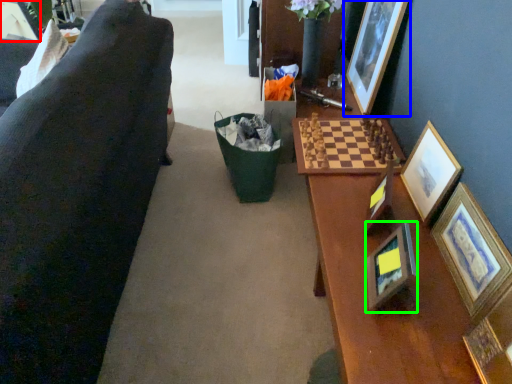
Question: Which object is the closest to the picture frame (highlighted by a red box)? Choose among these: picture frame (highlighted by a blue box) or picture frame (highlighted by a green box).

Choices:
 (A) picture frame
 (B) picture frame

Answer: (A)